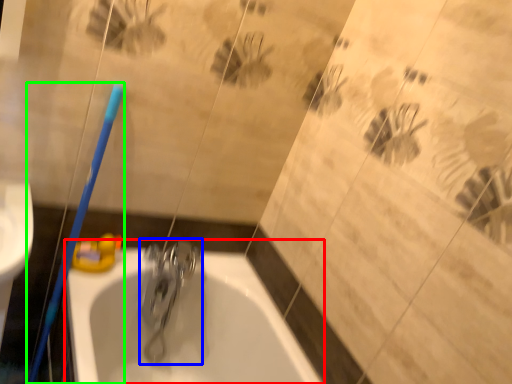
Question: Which is nearer to the bathtub (highlighted by a red box)? tap (highlighted by a blue box) or toothbrush (highlighted by a green box).

Choices:
 (A) tap
 (B) toothbrush

Answer: (A)